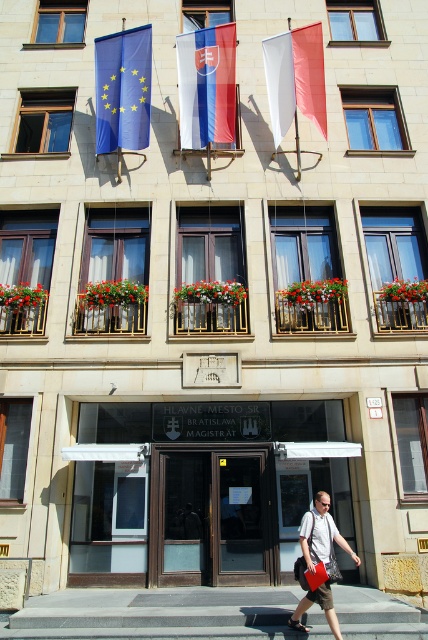
You are standing in front of the building and want to take a photo. There are two points on the facade marked as point 1 at coordinates (181, 74) and point 2 at coordinates (323, 534). Which point is closer to you when you are facing the building?

Point 1 at coordinates (181, 74) is closer to you because it is further to the camera than point 2 at coordinates 0.8, 0.755.

You are a delivery person carrying a heavy package and need to reach the entrance of the building. The entrance is located near the gray concrete stairs at center and the matte gray shirt at center. Considering your package is 1.5 meters wide, will you be able to pass through the space between them?

The distance between the gray concrete stairs at center and the matte gray shirt at center is 1.58 meters. Since your package is 1.5 meters wide, it should fit with a small amount of space to spare.

You are standing in front of the building and want to enter. Where are the gray concrete stairs at center located relative to the entrance?

The gray concrete stairs at center are located at point coordinates approximately 0.959 on the x axis and 0.367 on the y axis, so they are positioned to the right and slightly above the entrance area.